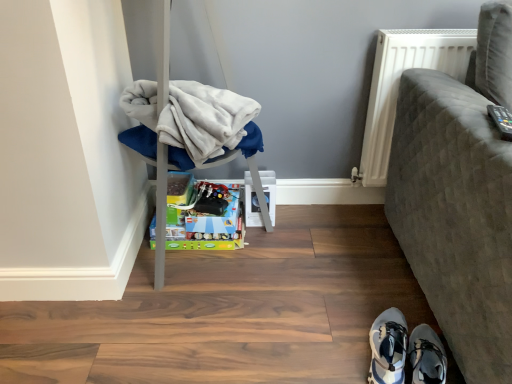
Question: Considering the relative sizes of light blue fabric shoe at lower right, the first footwear viewed from the left, and white textured radiator at upper right in the image provided, is light blue fabric shoe at lower right, the first footwear viewed from the left, smaller than white textured radiator at upper right?

Choices:
 (A) no
 (B) yes

Answer: (B)

Question: Does light blue fabric shoe at lower right, the first footwear viewed from the left, appear on the right side of white textured radiator at upper right?

Choices:
 (A) yes
 (B) no

Answer: (B)

Question: From a real-world perspective, is light blue fabric shoe at lower right, the first footwear viewed from the left, on top of white textured radiator at upper right?

Choices:
 (A) no
 (B) yes

Answer: (A)

Question: Is light blue fabric shoe at lower right, the first footwear viewed from the left, positioned with its back to white textured radiator at upper right?

Choices:
 (A) yes
 (B) no

Answer: (B)

Question: Considering the relative sizes of light blue fabric shoe at lower right, which is the 2th footwear from right to left, and white textured radiator at upper right in the image provided, is light blue fabric shoe at lower right, which is the 2th footwear from right to left, bigger than white textured radiator at upper right?

Choices:
 (A) yes
 (B) no

Answer: (B)

Question: Is light blue fabric shoe at lower right, the first footwear viewed from the left, thinner than white textured radiator at upper right?

Choices:
 (A) no
 (B) yes

Answer: (A)

Question: Does soft gray fabric chair at left, which is counted as the 1th furniture, starting from the left, have a greater width compared to shiny metallic toy at center?

Choices:
 (A) no
 (B) yes

Answer: (B)

Question: Is soft gray fabric chair at left, which is counted as the 1th furniture, starting from the left, at the right side of shiny metallic toy at center?

Choices:
 (A) no
 (B) yes

Answer: (B)

Question: Considering the relative sizes of soft gray fabric chair at left, which is counted as the 1th furniture, starting from the left, and shiny metallic toy at center in the image provided, is soft gray fabric chair at left, which is counted as the 1th furniture, starting from the left, smaller than shiny metallic toy at center?

Choices:
 (A) yes
 (B) no

Answer: (B)

Question: Is soft gray fabric chair at left, which is counted as the 1th furniture, starting from the left, far from shiny metallic toy at center?

Choices:
 (A) yes
 (B) no

Answer: (B)

Question: From the image's perspective, would you say soft gray fabric chair at left, which is counted as the 1th furniture, starting from the left, is positioned over shiny metallic toy at center?

Choices:
 (A) yes
 (B) no

Answer: (A)

Question: Is soft gray fabric chair at left, placed as the 2th furniture when sorted from right to left, positioned with its back to shiny metallic toy at center?

Choices:
 (A) no
 (B) yes

Answer: (B)

Question: From a real-world perspective, is textured gray sofa at right, which is counted as the second furniture, starting from the left, physically below light blue fabric shoe at lower right, which is the 2th footwear from right to left?

Choices:
 (A) yes
 (B) no

Answer: (B)